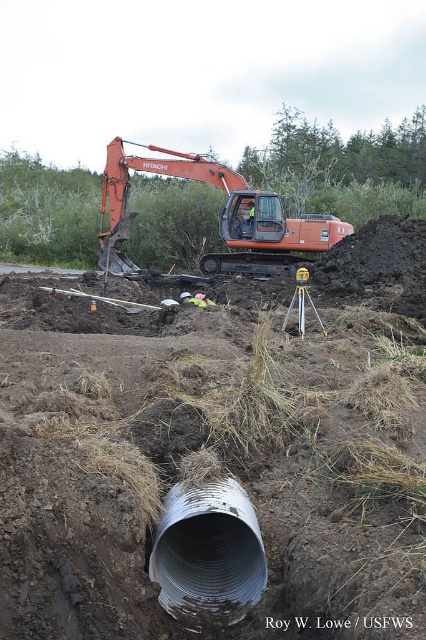
You are standing at the origin point of the construction site coordinate system. You need to locate the silver corrugated pipe at center. What are its coordinates?

The silver corrugated pipe at center is located at coordinates point (x=207, y=552).

You are a safety inspector standing at the edge of the construction site. You need to walk from your current position to the reflective safety vest at center to check its compliance. However, there is an obstacle in the path. The obstacle is the smooth brown dirt at center. Can you safely walk around the obstacle to reach the vest without stepping on the dirt? The minimum safe distance required to bypass the obstacle is 2 meters.

The smooth brown dirt at center is 12.31 meters away from the reflective safety vest at center. Since the minimum safe distance required to bypass the obstacle is 2 meters, and the distance between them is more than sufficient, you can safely walk around the obstacle to reach the vest without stepping on the dirt.

You are standing at the origin point in the image. The orange metallic excavator at center is located at coordinates 0.339 on the x axis and 0.514 on the y axis. If you want to walk directly to the excavator, in which direction should you move? Please provide your answer in terms of compass directions like north, south, east, west, northeast, etc.

The orange metallic excavator at center is located at coordinates 0.339 on the x axis and 0.514 on the y axis. Since the origin is at the bottom left corner of the image, moving towards the excavator would require moving northeast because the excavator is to the northeast of the origin point.